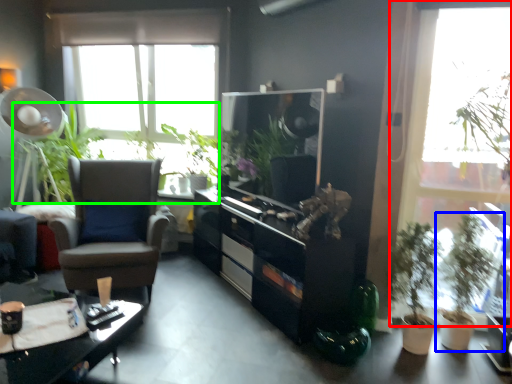
Question: Considering the real-world distances, which object is closest to window (highlighted by a red box)? houseplant (highlighted by a blue box) or vegetation (highlighted by a green box).

Choices:
 (A) houseplant
 (B) vegetation

Answer: (A)